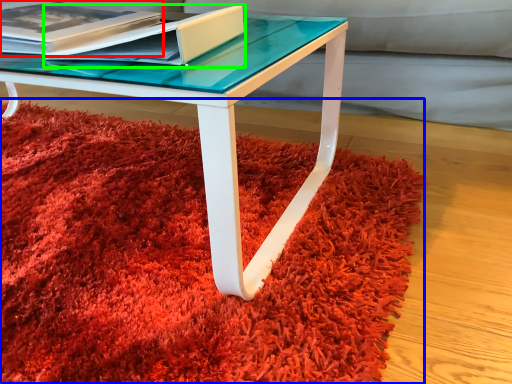
Question: Which object is positioned farthest from paperback book (highlighted by a red box)? Select from mat (highlighted by a blue box) and paperback book (highlighted by a green box).

Choices:
 (A) mat
 (B) paperback book

Answer: (A)